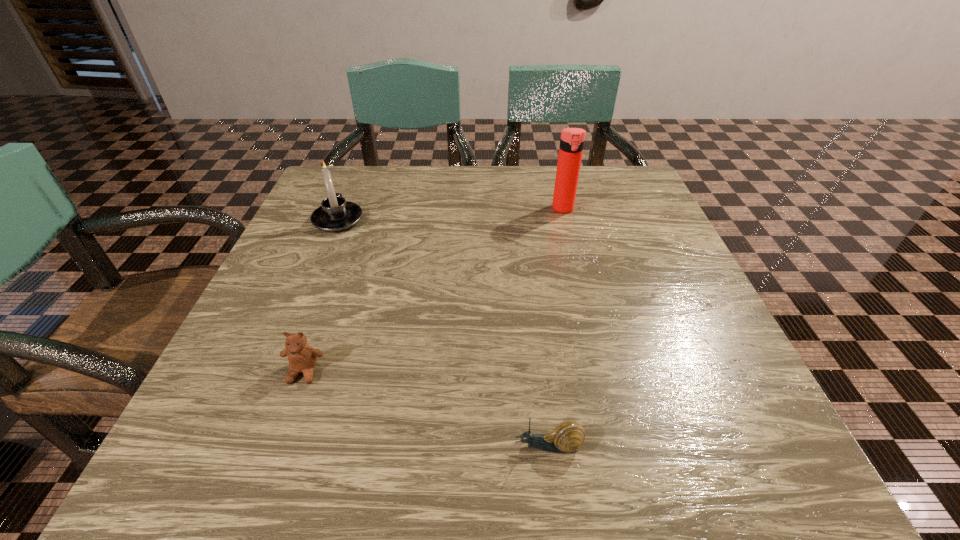
Locate an element on the screen. free point that satisfies the following two spatial constraints: 1. on the front side of the rightmost object; 2. on the front-facing side of the second object from right to left is located at coordinates (x=623, y=446).

Find the location of `free location that satisfies the following two spatial constraints: 1. on the front side of the rightmost object; 2. on the front-facing side of the shortest object`. free location that satisfies the following two spatial constraints: 1. on the front side of the rightmost object; 2. on the front-facing side of the shortest object is located at coordinates (623, 446).

Where is `vacant area that satisfies the following two spatial constraints: 1. with a handle on the side of the rightmost object; 2. on the right side of the third shortest object`? The height and width of the screenshot is (540, 960). vacant area that satisfies the following two spatial constraints: 1. with a handle on the side of the rightmost object; 2. on the right side of the third shortest object is located at coordinates (343, 209).